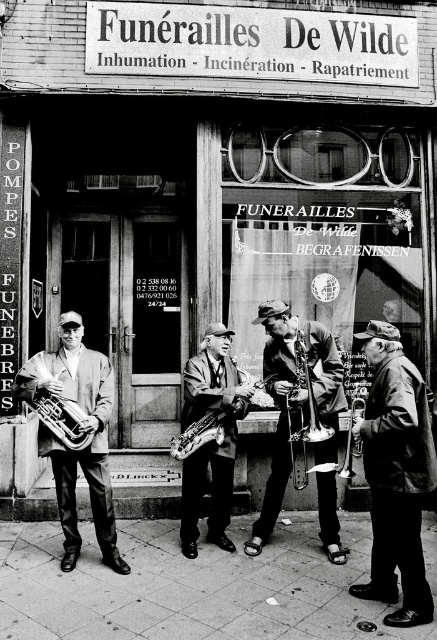
You are a photographer standing at the entrance of the funeral home. You want to take a photo of the leather jacket at right without moving closer than 15 feet from it. Is this possible?

The leather jacket at right is 16.69 feet away from the camera, so yes, you can take the photo without moving closer than 15 feet since the distance is greater than the required minimum.

You are a photographer standing in front of the funeral home. You want to take a photo of the leather jacket at right. Where should you position yourself to capture the jacket in the frame?

To capture the leather jacket at right in the frame, position yourself so that the jacket is centered at the point corresponding to coordinates approximately 0.744 on the horizontal axis and 0.906 on the vertical axis.

You are a photographer at the scene. You want to capture a photo that includes both the leather jacket at right and the satin saxophone at center. Which object should you position closer to the bottom of the frame to ensure both are visible?

To include both the leather jacket at right and the satin saxophone at center in the photo, position the leather jacket at right closer to the bottom of the frame since it is located below the satin saxophone at center.